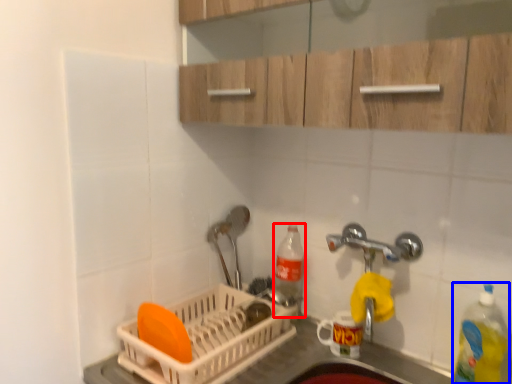
Question: Which point is further to the camera, bottle (highlighted by a red box) or bottle (highlighted by a blue box)?

Choices:
 (A) bottle
 (B) bottle

Answer: (A)